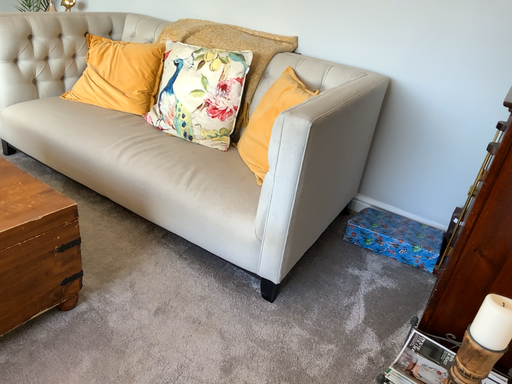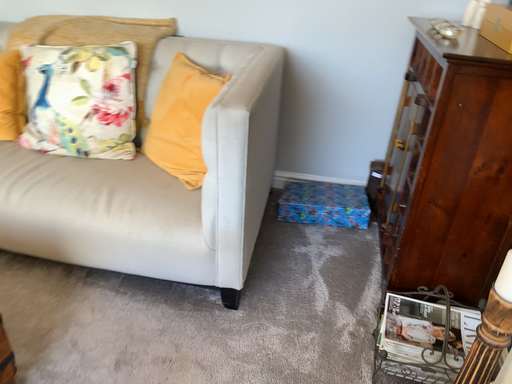
Question: Which way did the camera rotate in the video?

Choices:
 (A) rotated left
 (B) rotated right

Answer: (B)